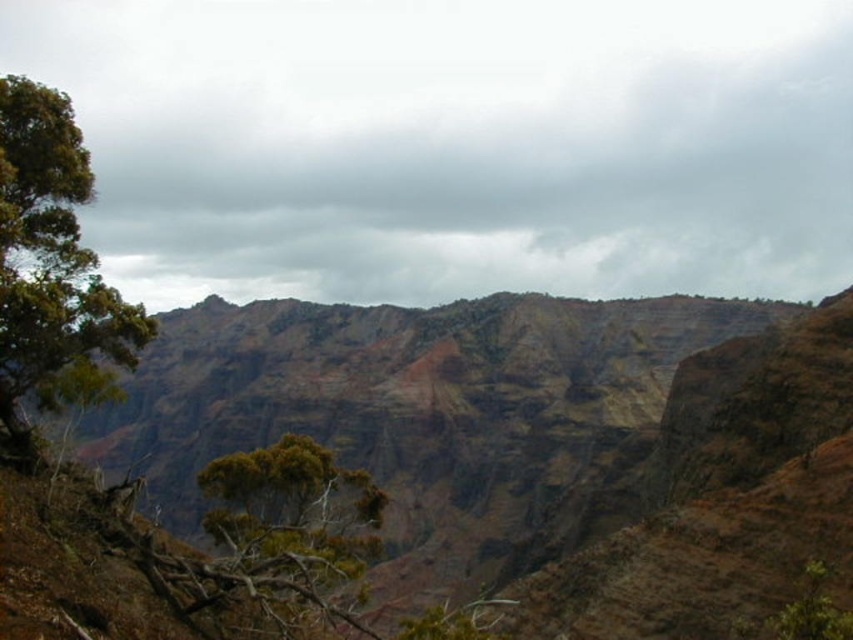
Question: Can you confirm if brown rocky mountain at center is positioned above green leafy tree at left?

Choices:
 (A) no
 (B) yes

Answer: (A)

Question: Does brown rocky mountain at center have a lesser width compared to green leafy tree at center?

Choices:
 (A) no
 (B) yes

Answer: (A)

Question: Which is farther from the brown rocky mountain at center?

Choices:
 (A) green leafy tree at center
 (B) green leafy tree at left

Answer: (B)

Question: Is brown rocky mountain at center bigger than green leafy tree at left?

Choices:
 (A) no
 (B) yes

Answer: (B)

Question: Which is farther from the brown rocky mountain at center?

Choices:
 (A) green leafy tree at center
 (B) green leafy tree at left

Answer: (B)

Question: Which object is positioned closest to the brown rocky mountain at center?

Choices:
 (A) green leafy tree at center
 (B) green leafy tree at left

Answer: (A)